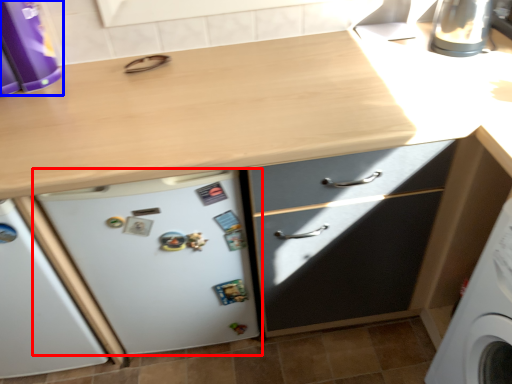
Question: Which point is closer to the camera, refrigerator (highlighted by a red box) or kitchen appliance (highlighted by a blue box)?

Choices:
 (A) refrigerator
 (B) kitchen appliance

Answer: (B)